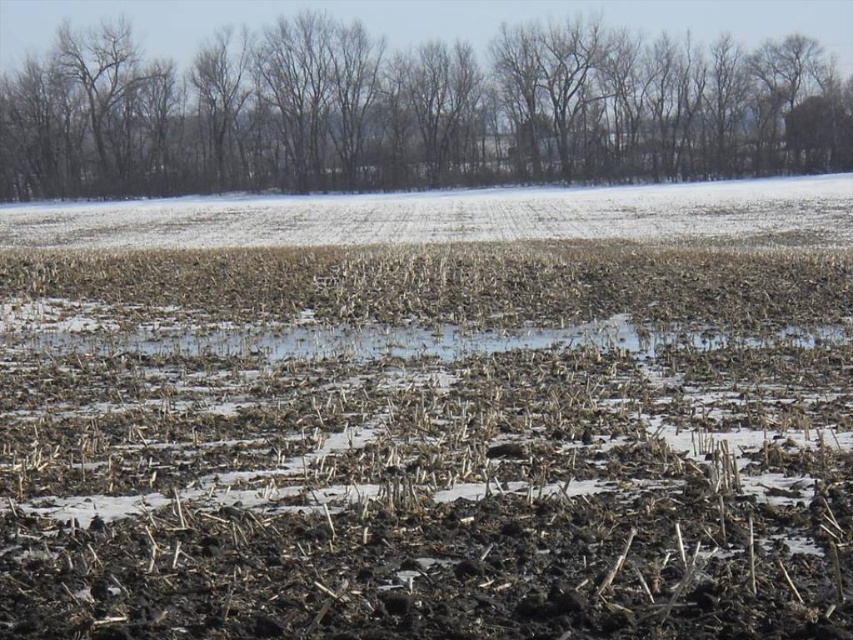
Question: Does brown soil at center appear under brown leafless trees at upper center?

Choices:
 (A) yes
 (B) no

Answer: (A)

Question: Does brown soil at center have a smaller size compared to brown leafless trees at upper center?

Choices:
 (A) no
 (B) yes

Answer: (A)

Question: Which point appears farthest from the camera in this image?

Choices:
 (A) (250, 148)
 (B) (137, 579)

Answer: (A)

Question: Which object is closer to the camera taking this photo?

Choices:
 (A) brown soil at center
 (B) brown leafless trees at upper center

Answer: (A)

Question: Among these objects, which one is farthest from the camera?

Choices:
 (A) brown soil at center
 (B) brown leafless trees at upper center

Answer: (B)

Question: Does brown soil at center lie behind brown leafless trees at upper center?

Choices:
 (A) yes
 (B) no

Answer: (B)